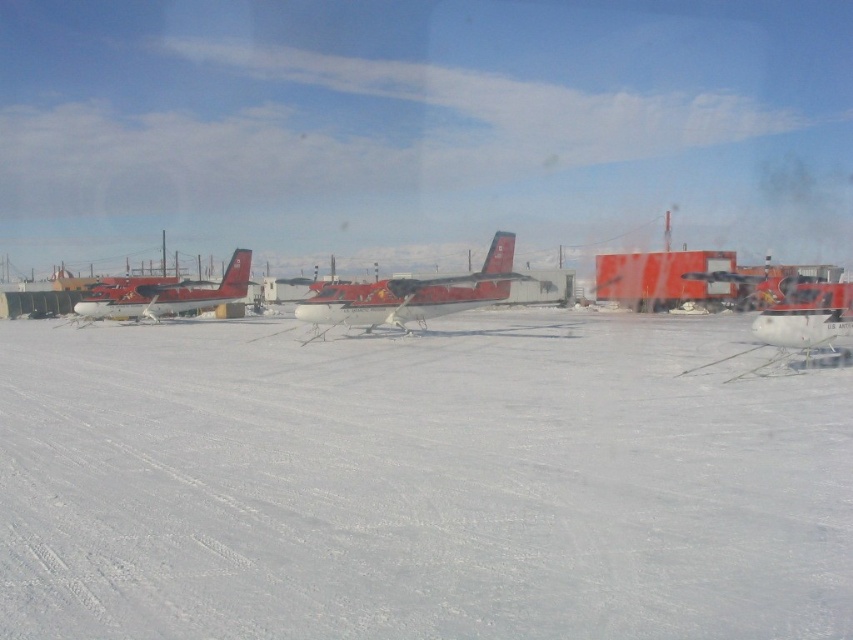
You are a pilot planning to taxi the metallic red airplane at center and the white matte airplane at right. Since both are on the same runway, which airplane would you need to move first to avoid blocking the other?

The metallic red airplane at center is located above the white matte airplane at right, so you should move the metallic red airplane at center first to avoid blocking the white matte airplane at right.

You are a pilot preparing to land a small aircraft in this snowy area. You need to determine where to position your plane so that it stays on the white matte snow at center. Based on the scene, where should you place your plane relative to the metallic red airplane at center?

The white matte snow at center is below the metallic red airplane at center, so to position your plane on the snow, you should place it below the metallic red airplane at center.